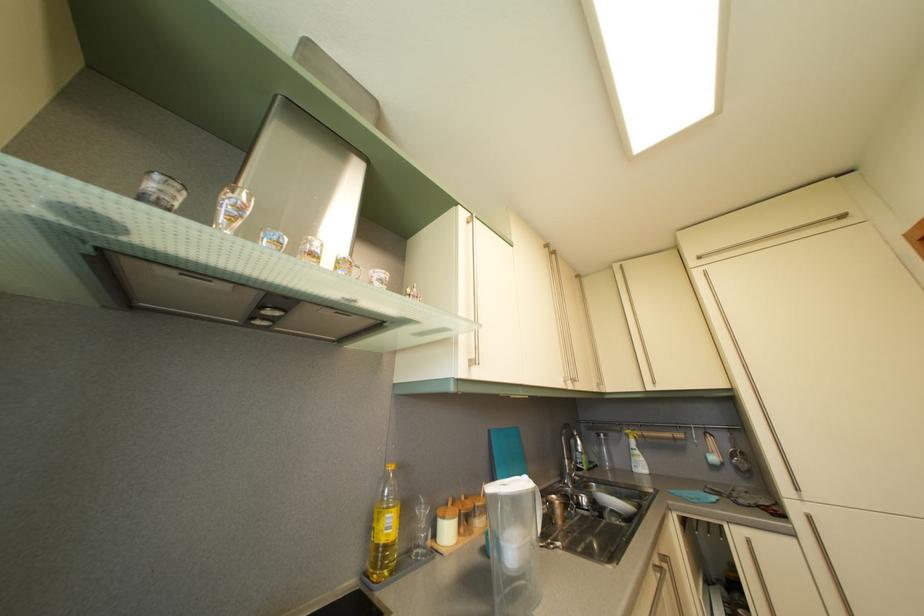
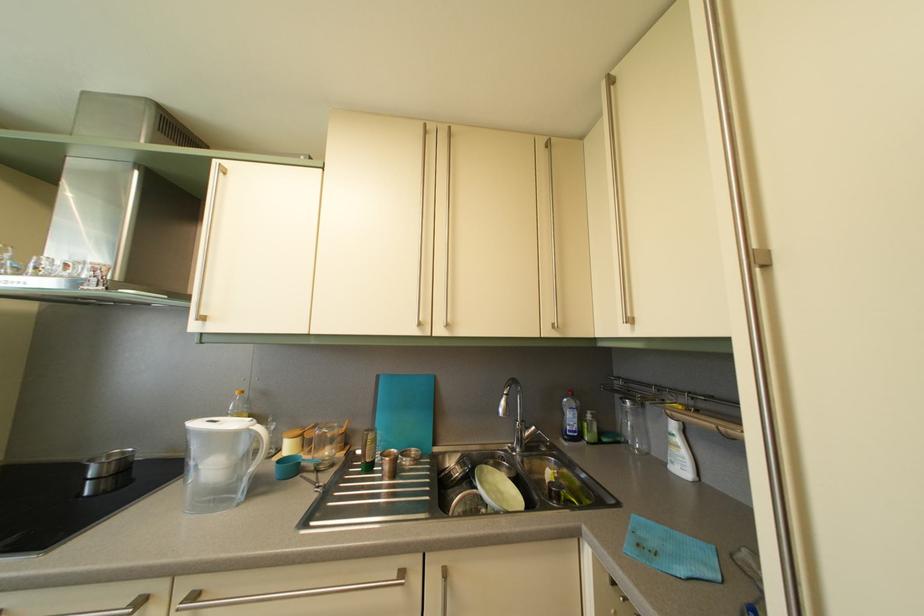
Where in the second image is the point corresponding to (646,460) from the first image?

(687, 448)